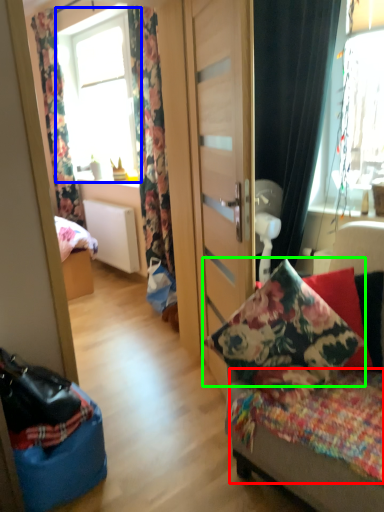
Question: Which object is positioned farthest from bedding (highlighted by a red box)? Select from window (highlighted by a blue box) and pillow (highlighted by a green box).

Choices:
 (A) window
 (B) pillow

Answer: (A)